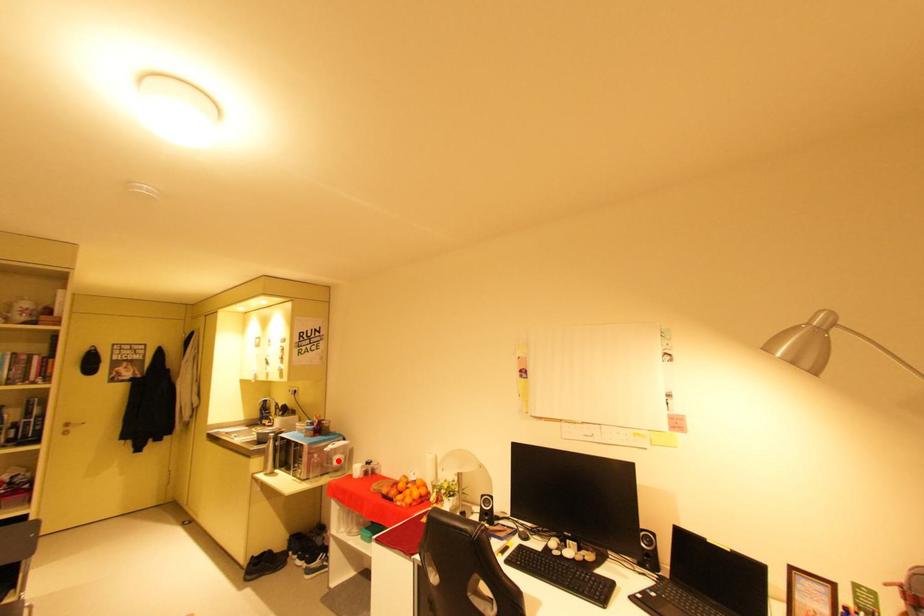
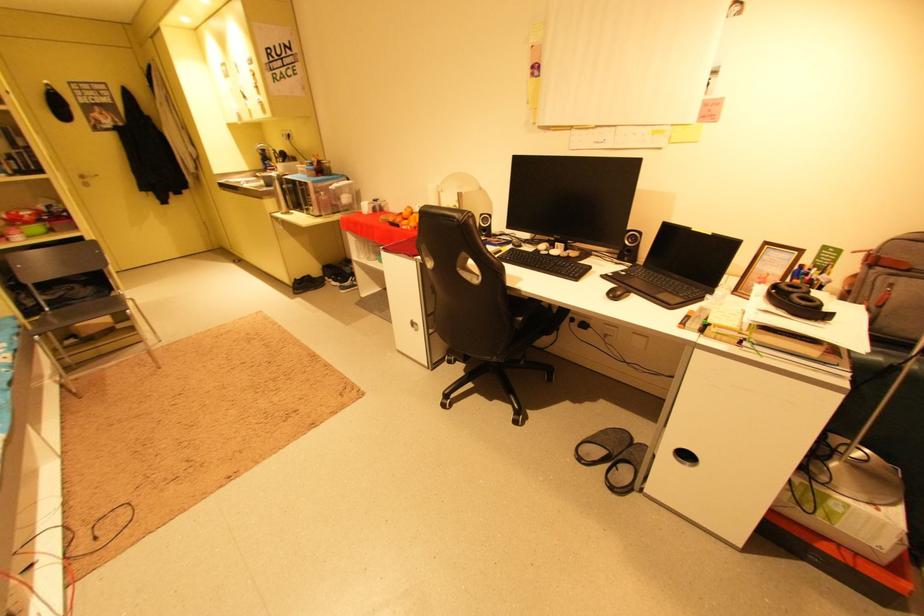
Question: I am providing you with two images of the same scene from different viewpoints. Image1 has a red point marked. In image2, the corresponding 3D location appears at what relative position? Reply with the corresponding letter.

Choices:
 (A) Closer
 (B) Farther

Answer: (A)